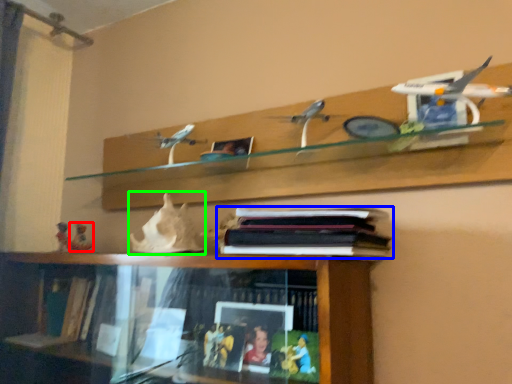
Question: Considering the real-world distances, which object is farthest from toy (highlighted by a red box)? book (highlighted by a blue box) or toy (highlighted by a green box)?

Choices:
 (A) book
 (B) toy

Answer: (A)